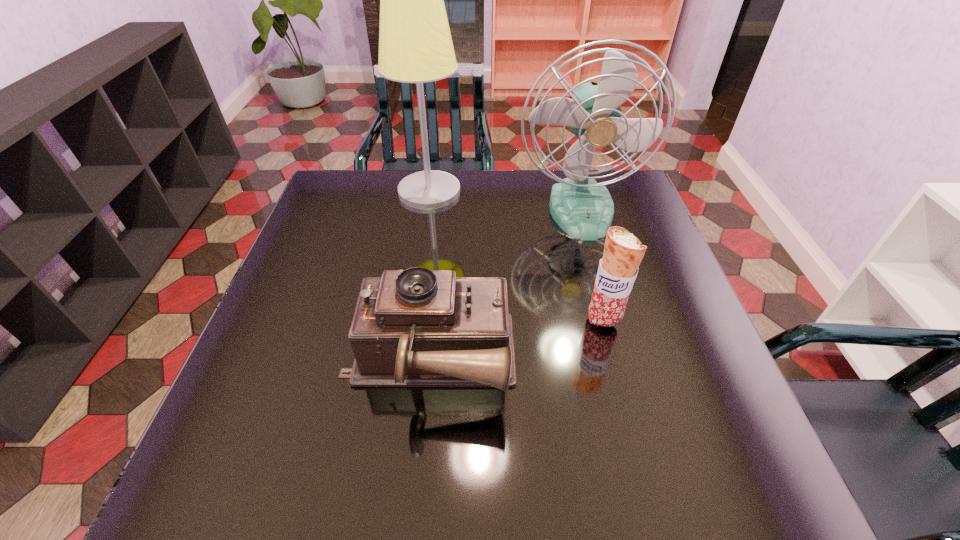
Where is `object present at the right edge`? The image size is (960, 540). object present at the right edge is located at coordinates (584, 209).

Image resolution: width=960 pixels, height=540 pixels. What are the coordinates of `object that is positioned at the far right corner` in the screenshot? It's located at (584, 209).

Locate an element on the screen. This screenshot has height=540, width=960. vacant space at the far edge of the desktop is located at coordinates (460, 200).

In the image, there is a desktop. Identify the location of vacant space at the near edge. The height and width of the screenshot is (540, 960). (365, 470).

The image size is (960, 540). In the image, there is a desktop. Find the location of `vacant space at the left edge`. vacant space at the left edge is located at coordinates (295, 450).

Find the location of a particular element. free space at the right edge of the desktop is located at coordinates (677, 408).

This screenshot has height=540, width=960. What are the coordinates of `free space at the far left corner of the desktop` in the screenshot? It's located at click(352, 188).

This screenshot has height=540, width=960. What are the coordinates of `vacant region between the third shortest object and the second shortest object` in the screenshot? It's located at (592, 265).

Locate an element on the screen. The image size is (960, 540). vacant region between the burrito and the third shortest object is located at coordinates (592, 265).

Where is `free area in between the burrito and the phonograph_record`? Image resolution: width=960 pixels, height=540 pixels. free area in between the burrito and the phonograph_record is located at coordinates (516, 341).